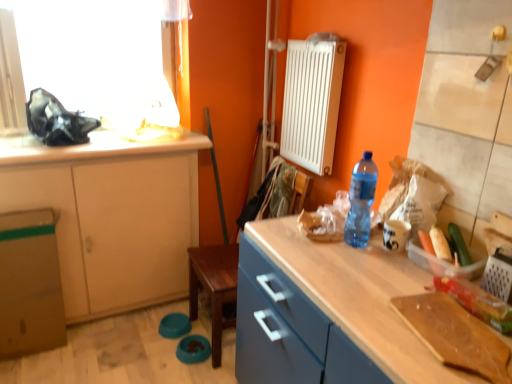
What do you see at coordinates (459, 245) in the screenshot? I see `green matte cucumber at right, which is the 1th vegetable from back to front` at bounding box center [459, 245].

The image size is (512, 384). What do you see at coordinates (29, 284) in the screenshot?
I see `brown cardboard box at lower left` at bounding box center [29, 284].

What do you see at coordinates (312, 101) in the screenshot? I see `white metallic radiator at center right` at bounding box center [312, 101].

Image resolution: width=512 pixels, height=384 pixels. What do you see at coordinates (435, 243) in the screenshot?
I see `translucent plastic container at right` at bounding box center [435, 243].

Find the location of a particular element. This screenshot has height=384, width=512. translucent plastic container at right is located at coordinates (435, 243).

Locate an element on the screen. The height and width of the screenshot is (384, 512). green matte cucumber at right, which is the 1th vegetable from back to front is located at coordinates (459, 245).

Can you confirm if white matte countertop at upper left is taller than wooden cutting board at lower right?

Yes, white matte countertop at upper left is taller than wooden cutting board at lower right.

Based on their positions, is white matte countertop at upper left located to the left or right of wooden cutting board at lower right?

From the image, it's evident that white matte countertop at upper left is to the left of wooden cutting board at lower right.

Is white matte countertop at upper left far from wooden cutting board at lower right?

Yes, white matte countertop at upper left and wooden cutting board at lower right are quite far apart.

Based on their positions, is green plastic bag at right, marked as the 1th vegetable in a front-to-back arrangement, located to the left or right of matte wood cabinet at left?

Based on their positions, green plastic bag at right, marked as the 1th vegetable in a front-to-back arrangement, is located to the right of matte wood cabinet at left.

From a real-world perspective, which is physically above, green plastic bag at right, marked as the 1th vegetable in a front-to-back arrangement, or matte wood cabinet at left?

From a 3D spatial view, green plastic bag at right, marked as the 1th vegetable in a front-to-back arrangement, is above.

Is point (451, 285) in front of point (78, 225)?

That is True.

Is green plastic bag at right, marked as the 1th vegetable in a front-to-back arrangement, further to the viewer compared to matte wood cabinet at left?

No, it is not.

Between blue plastic bottle at right and green plastic bag at right, the 2th vegetable from the top, which one appears on the right side from the viewer's perspective?

green plastic bag at right, the 2th vegetable from the top.

Does blue plastic bottle at right have a greater width compared to green plastic bag at right, the 2th vegetable from the top?

Indeed, blue plastic bottle at right has a greater width compared to green plastic bag at right, the 2th vegetable from the top.

From the picture: Is blue plastic bottle at right inside or outside of green plastic bag at right, the 2th vegetable from the top?

blue plastic bottle at right is not enclosed by green plastic bag at right, the 2th vegetable from the top.

From the image's perspective, is blue plastic bottle at right located above or below green plastic bag at right, marked as the 1th vegetable in a front-to-back arrangement?

blue plastic bottle at right is above green plastic bag at right, marked as the 1th vegetable in a front-to-back arrangement.

Can you confirm if green plastic bag at right, positioned as the 1th vegetable in bottom-to-top order, is thinner than brown cardboard box at lower left?

Indeed, green plastic bag at right, positioned as the 1th vegetable in bottom-to-top order, has a lesser width compared to brown cardboard box at lower left.

From the picture: Is green plastic bag at right, positioned as the 1th vegetable in bottom-to-top order, further to the viewer compared to brown cardboard box at lower left?

No, it is not.

Between point (477, 299) and point (38, 223), which one is positioned in front?

The point (477, 299) is closer.

Is green plastic bag at right, marked as the 1th vegetable in a front-to-back arrangement, directly adjacent to brown cardboard box at lower left?

No, green plastic bag at right, marked as the 1th vegetable in a front-to-back arrangement, is not making contact with brown cardboard box at lower left.

Can you tell me how much matte wood cabinet at left and white matte countertop at upper left differ in facing direction?

The facing directions of matte wood cabinet at left and white matte countertop at upper left are 0.000286 degrees apart.

Considering the positions of points (42, 193) and (178, 144), is point (42, 193) farther from camera compared to point (178, 144)?

That is False.

Would you consider matte wood cabinet at left to be distant from white matte countertop at upper left?

That's not correct — matte wood cabinet at left is a little close to white matte countertop at upper left.

From the image's perspective, is matte wood cabinet at left above or below white matte countertop at upper left?

matte wood cabinet at left is situated lower than white matte countertop at upper left in the image.

Are blue plastic bottle at right and matte wood cabinet at left located far from each other?

Yes.

At what (x,y) coordinates should I click in order to perform the action: click on cabinetry that is below the blue plastic bottle at right (from the image's perspective). Please return your answer as a coordinate pair (x, y). The height and width of the screenshot is (384, 512). Looking at the image, I should click on (111, 215).

From the picture: Would you say blue plastic bottle at right is inside or outside matte wood cabinet at left?

blue plastic bottle at right is not enclosed by matte wood cabinet at left.

From a real-world perspective, is blue plastic bottle at right positioned over matte wood cabinet at left based on gravity?

Yes, from a real-world perspective, blue plastic bottle at right is over matte wood cabinet at left

From the image's perspective, which one is positioned higher, matte wood cabinet at left or green plastic bag at right, positioned as the 1th vegetable in bottom-to-top order?

matte wood cabinet at left is shown above in the image.

Is matte wood cabinet at left far away from green plastic bag at right, the 2th vegetable from the top?

matte wood cabinet at left is far away from green plastic bag at right, the 2th vegetable from the top.

From a real-world perspective, is matte wood cabinet at left on green plastic bag at right, marked as the 2th vegetable in a back-to-front arrangement?

No, from a real-world perspective, matte wood cabinet at left is not over green plastic bag at right, marked as the 2th vegetable in a back-to-front arrangement

Measure the distance from matte wood cabinet at left to green plastic bag at right, the 2th vegetable from the top.

matte wood cabinet at left is 1.57 meters away from green plastic bag at right, the 2th vegetable from the top.

In order to click on cutting board that is on the right side of white matte countertop at upper left in this screenshot , I will do `click(455, 335)`.

Find the location of a particular element. cabinetry behind the green plastic bag at right, the 2th vegetable from the top is located at coordinates (111, 215).

From the image, which object appears to be farther from green plastic bag at right, positioned as the 1th vegetable in bottom-to-top order, blue plastic bottle at right or matte wood cabinet at left?

The object further to green plastic bag at right, positioned as the 1th vegetable in bottom-to-top order, is matte wood cabinet at left.

Estimate the real-world distances between objects in this image. Which object is further from wooden cutting board at lower right, blue plastic bottle at right or white metallic radiator at center right?

white metallic radiator at center right lies further to wooden cutting board at lower right than the other object.

Looking at the image, which one is located closer to white metallic radiator at center right, blue plastic bottle at right or green matte cucumber at right, placed as the 2th vegetable when sorted from bottom to top?

blue plastic bottle at right is positioned closer to the anchor white metallic radiator at center right.

Looking at the image, which one is located further to matte wood cabinet at left, blue plastic bottle at right or white metallic radiator at center right?

Based on the image, blue plastic bottle at right appears to be further to matte wood cabinet at left.

When comparing their distances from blue plastic bottle at right, does white metallic radiator at center right or translucent plastic container at right seem further?

The object further to blue plastic bottle at right is white metallic radiator at center right.

When comparing their distances from matte wood cabinet at left, does green plastic bag at right, marked as the 2th vegetable in a back-to-front arrangement, or blue plastic bottle at right seem closer?

The object closer to matte wood cabinet at left is blue plastic bottle at right.

Looking at the image, which one is located closer to white metallic radiator at center right, translucent plastic container at right or wooden cutting board at lower right?

Among the two, translucent plastic container at right is located nearer to white metallic radiator at center right.

Estimate the real-world distances between objects in this image. Which object is closer to white matte countertop at upper left, white metallic radiator at center right or green plastic bag at right, marked as the 2th vegetable in a back-to-front arrangement?

Among the two, white metallic radiator at center right is located nearer to white matte countertop at upper left.

Identify the location of food located between green plastic bag at right, marked as the 2th vegetable in a back-to-front arrangement, and blue plastic bottle at right in the depth direction. This screenshot has width=512, height=384. (435, 243).

This screenshot has width=512, height=384. Identify the location of countertop situated between matte wood cabinet at left and green plastic bag at right, marked as the 2th vegetable in a back-to-front arrangement, from left to right. (94, 147).

Locate an element on the screen. The width and height of the screenshot is (512, 384). radiator between brown cardboard box at lower left and wooden cutting board at lower right in the horizontal direction is located at coordinates coord(312,101).

Locate an element on the screen. countertop between brown cardboard box at lower left and green matte cucumber at right, the 1th vegetable positioned from the top, in the horizontal direction is located at coordinates (94, 147).